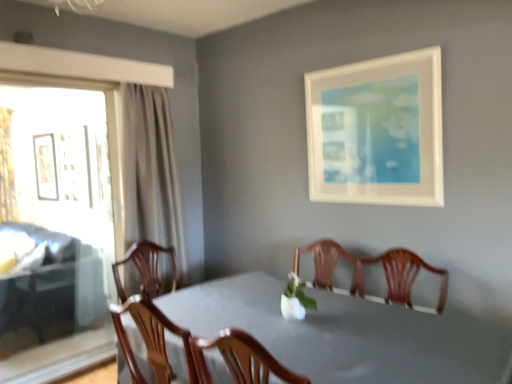
At what (x,y) coordinates should I click in order to perform the action: click on smooth gray table at center. Please return your answer as a coordinate pair (x, y). Looking at the image, I should click on (347, 334).

The width and height of the screenshot is (512, 384). Describe the element at coordinates (347, 334) in the screenshot. I see `smooth gray table at center` at that location.

The width and height of the screenshot is (512, 384). Identify the location of transparent glass window at left. (66, 207).

The height and width of the screenshot is (384, 512). I want to click on white matte picture frame at upper right, the first picture frame from the right, so click(x=377, y=131).

I want to click on gold textured curtain at left, so pos(7,169).

Locate an element on the screen. Image resolution: width=512 pixels, height=384 pixels. smooth gray table at center is located at coordinates (347, 334).

Does smooth gray table at center lie behind matte black picture frame at left, arranged as the 2th picture frame when viewed from the front?

That is False.

Can you confirm if smooth gray table at center is shorter than matte black picture frame at left, the 1th picture frame viewed from the left?

Yes, smooth gray table at center is shorter than matte black picture frame at left, the 1th picture frame viewed from the left.

From a real-world perspective, which object rests below the other?

In real-world perspective, smooth gray table at center is lower.

Locate an element on the screen. table that appears in front of the matte black picture frame at left, which ranks as the second picture frame in right-to-left order is located at coordinates (347, 334).

From the picture: Considering the relative positions of gold textured curtain at left and white matte picture frame at upper right, the second picture frame viewed from the back, in the image provided, is gold textured curtain at left in front of white matte picture frame at upper right, the second picture frame viewed from the back,?

No, gold textured curtain at left is further to the viewer.

Is point (4, 164) positioned before point (329, 169)?

No, it is behind (329, 169).

Is gold textured curtain at left completely or partially outside of white matte picture frame at upper right, the first picture frame from the right?

Absolutely, gold textured curtain at left is external to white matte picture frame at upper right, the first picture frame from the right.

What are the coordinates of `the 2nd picture frame in front when counting from the gold textured curtain at left` in the screenshot? It's located at (377, 131).

Considering the sizes of transparent glass window at left and white matte vase at center in the image, is transparent glass window at left bigger or smaller than white matte vase at center?

transparent glass window at left is bigger than white matte vase at center.

From a real-world perspective, is transparent glass window at left positioned over white matte vase at center based on gravity?

Yes, from a real-world perspective, transparent glass window at left is on top of white matte vase at center.

Which of these two, transparent glass window at left or white matte vase at center, is wider?

With larger width is white matte vase at center.

Which point is more forward, (x=1, y=110) or (x=510, y=341)?

Point (x=510, y=341)

Looking at this image, is gold textured curtain at left oriented towards smooth gray table at center?

Yes.

How different are the orientations of gold textured curtain at left and smooth gray table at center in degrees?

The angle between the facing direction of gold textured curtain at left and the facing direction of smooth gray table at center is 89.5 degrees.

Considering the sizes of gold textured curtain at left and smooth gray table at center in the image, is gold textured curtain at left taller or shorter than smooth gray table at center?

In the image, gold textured curtain at left appears to be taller than smooth gray table at center.

Does point (57, 295) appear closer or farther from the camera than point (453, 374)?

Point (57, 295) is farther from the camera than point (453, 374).

Is transparent glass window at left located outside smooth gray table at center?

Yes, transparent glass window at left is located beyond the bounds of smooth gray table at center.

Does transparent glass window at left have a greater height compared to smooth gray table at center?

Yes.

Considering the sizes of objects transparent glass window at left and white matte picture frame at upper right, the second picture frame viewed from the back, in the image provided, who is shorter, transparent glass window at left or white matte picture frame at upper right, the second picture frame viewed from the back,?

With less height is white matte picture frame at upper right, the second picture frame viewed from the back.

Looking at this image, does transparent glass window at left have a larger size compared to white matte picture frame at upper right, acting as the 2th picture frame starting from the left?

Yes.

Based on their positions, is transparent glass window at left located to the left or right of white matte picture frame at upper right, acting as the 2th picture frame starting from the left?

transparent glass window at left is to the left of white matte picture frame at upper right, acting as the 2th picture frame starting from the left.

Is transparent glass window at left facing away from white matte picture frame at upper right, which ranks as the 1th picture frame in front-to-back order?

No, white matte picture frame at upper right, which ranks as the 1th picture frame in front-to-back order, is not at the back of transparent glass window at left.

Is white matte picture frame at upper right, the second picture frame viewed from the back, directly adjacent to transparent glass window at left?

No, white matte picture frame at upper right, the second picture frame viewed from the back, is not making contact with transparent glass window at left.

From a real-world perspective, is white matte picture frame at upper right, the first picture frame from the right, physically below transparent glass window at left?

No, from a real-world perspective, white matte picture frame at upper right, the first picture frame from the right, is not under transparent glass window at left.

Considering the points (391, 128) and (49, 289), which point is behind, point (391, 128) or point (49, 289)?

Positioned behind is point (49, 289).

You are a GUI agent. You are given a task and a screenshot of the screen. Output one action in this format:
    pyautogui.click(x=<x>, y=<y>)
    Task: Click on the picture frame that is the 1st object above the smooth gray table at center (from a real-world perspective)
    
    Given the screenshot: What is the action you would take?
    pyautogui.click(x=45, y=167)

Locate an element on the screen. the 2nd picture frame in front when counting from the gold textured curtain at left is located at coordinates (377, 131).

Estimate the real-world distances between objects in this image. Which object is closer to transparent glass window at left, gold textured curtain at left or white matte vase at center?

gold textured curtain at left lies closer to transparent glass window at left than the other object.

When comparing their distances from matte black picture frame at left, which appears as the 1th picture frame when viewed from the back, does white matte picture frame at upper right, acting as the 2th picture frame starting from the left, or white matte vase at center seem closer?

white matte picture frame at upper right, acting as the 2th picture frame starting from the left.

Based on the photo, considering their positions, is transparent glass window at left positioned closer to gold textured curtain at left than smooth gray table at center?

The object closer to gold textured curtain at left is transparent glass window at left.

Looking at the image, which one is located further to smooth gray table at center, matte black picture frame at left, which ranks as the second picture frame in right-to-left order, or white matte vase at center?

matte black picture frame at left, which ranks as the second picture frame in right-to-left order.

Based on their spatial positions, is matte black picture frame at left, which ranks as the second picture frame in right-to-left order, or white matte picture frame at upper right, the first picture frame from the right, further from gold textured curtain at left?

Among the two, white matte picture frame at upper right, the first picture frame from the right, is located further to gold textured curtain at left.

Looking at the image, which one is located closer to smooth gray table at center, white matte picture frame at upper right, the first picture frame from the right, or gold textured curtain at left?

white matte picture frame at upper right, the first picture frame from the right, is closer to smooth gray table at center.

Based on their spatial positions, is white matte picture frame at upper right, the second picture frame viewed from the back, or gold textured curtain at left closer to white matte vase at center?

Based on the image, white matte picture frame at upper right, the second picture frame viewed from the back, appears to be nearer to white matte vase at center.

In the scene shown: Estimate the real-world distances between objects in this image. Which object is closer to white matte picture frame at upper right, which ranks as the 1th picture frame in front-to-back order, gold textured curtain at left or smooth gray table at center?

smooth gray table at center is positioned closer to the anchor white matte picture frame at upper right, which ranks as the 1th picture frame in front-to-back order.

Where is `floral arrangement situated between matte black picture frame at left, the 1th picture frame viewed from the left, and white matte picture frame at upper right, the second picture frame viewed from the back, from left to right`? floral arrangement situated between matte black picture frame at left, the 1th picture frame viewed from the left, and white matte picture frame at upper right, the second picture frame viewed from the back, from left to right is located at coordinates (296, 299).

In order to click on window located between smooth gray table at center and gold textured curtain at left in the depth direction in this screenshot , I will do `click(66, 207)`.

Where is `picture frame between transparent glass window at left and gold textured curtain at left along the z-axis`? picture frame between transparent glass window at left and gold textured curtain at left along the z-axis is located at coordinates (45, 167).

Where is `window between white matte vase at center and matte black picture frame at left, the 1th picture frame viewed from the left, in the front-back direction`? Image resolution: width=512 pixels, height=384 pixels. window between white matte vase at center and matte black picture frame at left, the 1th picture frame viewed from the left, in the front-back direction is located at coordinates (66, 207).